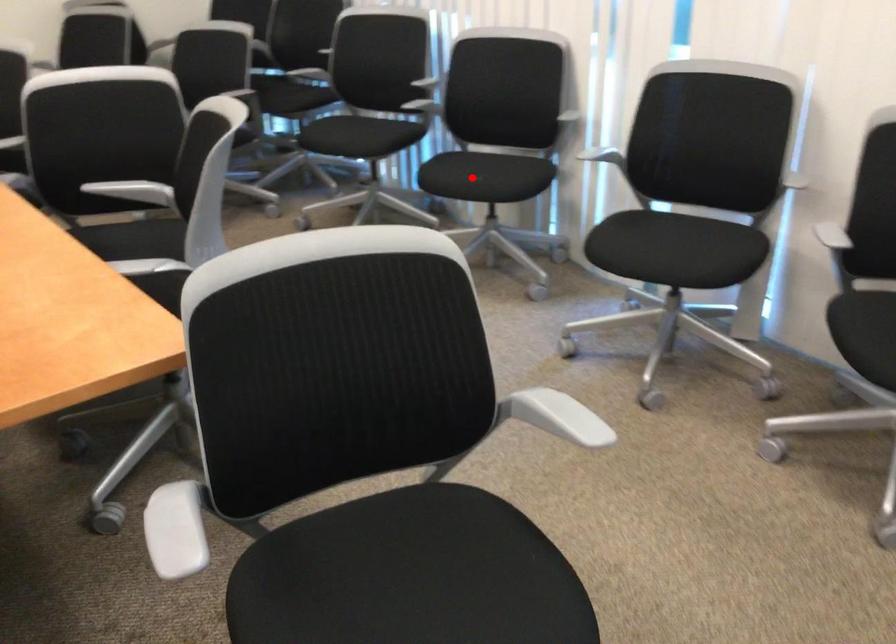
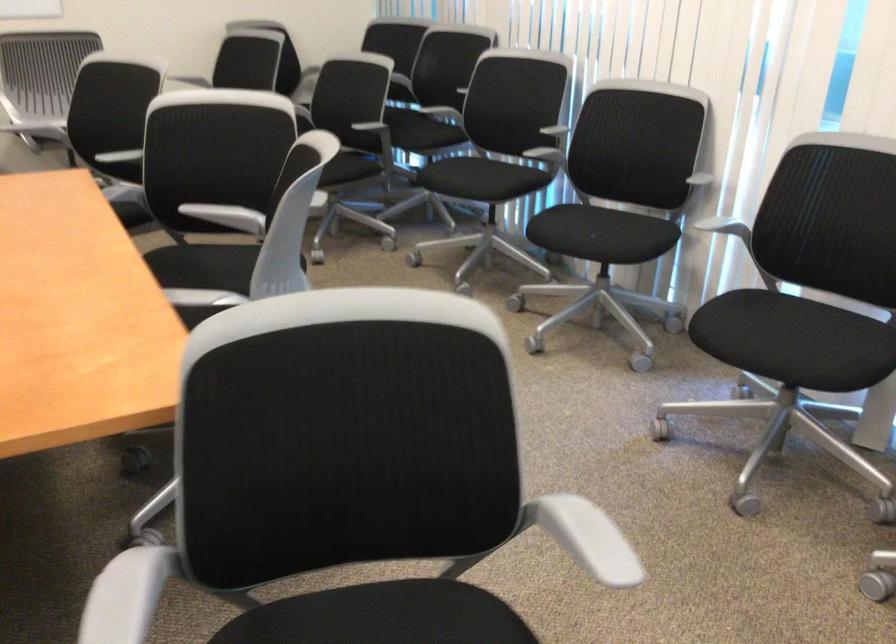
Where in the second image is the point corresponding to the highlighted location from the first image?

(582, 232)